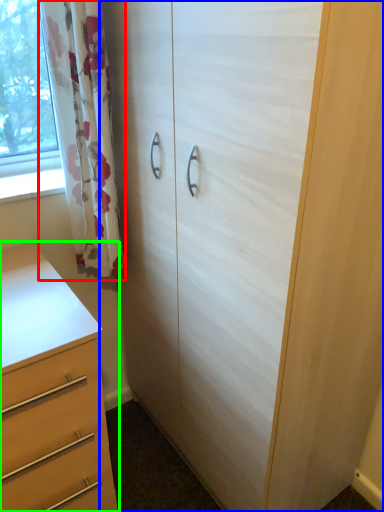
Question: Which object is positioned closest to curtain (highlighted by a red box)? Select from cupboard (highlighted by a blue box) and chest of drawers (highlighted by a green box).

Choices:
 (A) cupboard
 (B) chest of drawers

Answer: (A)